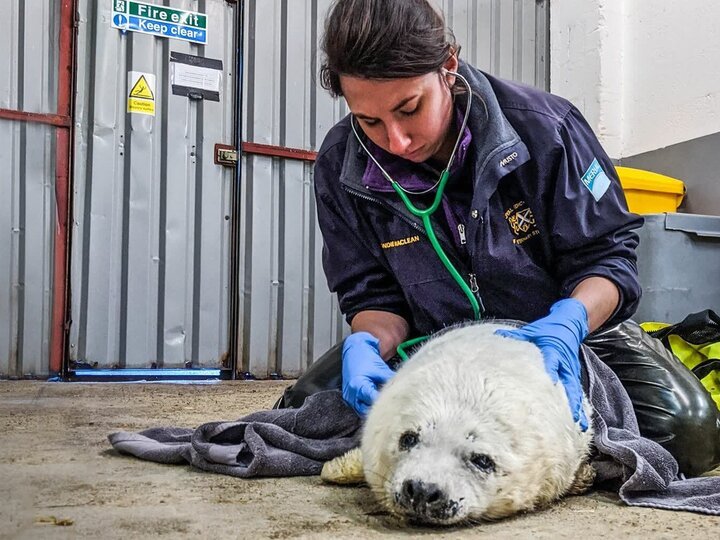
This screenshot has height=540, width=720. I want to click on wall, so click(134, 272).